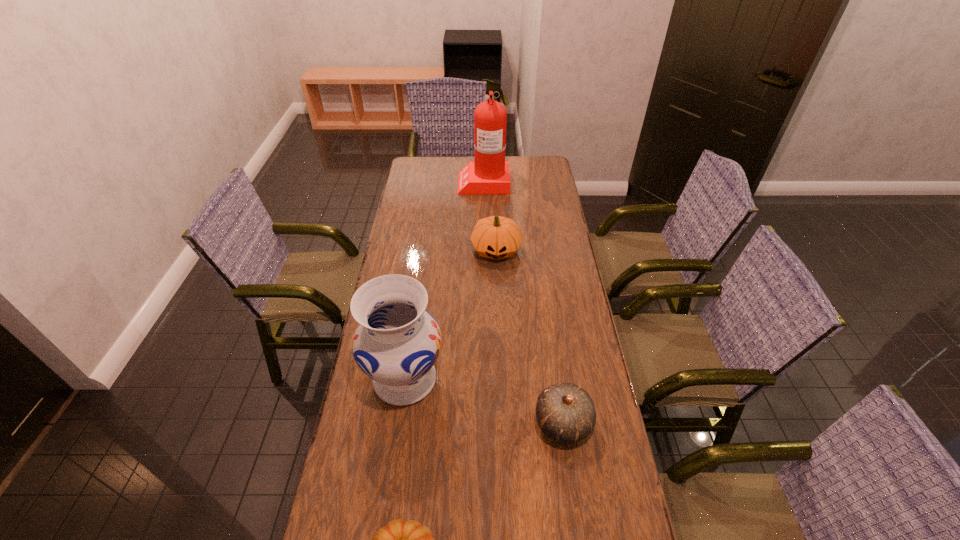
Find the location of a particular element. This screenshot has width=960, height=540. the farthest object is located at coordinates (489, 173).

Locate an element on the screen. fire extinguisher is located at coordinates (489, 173).

The height and width of the screenshot is (540, 960). Identify the location of vase. (397, 342).

Find the location of a particular element. The width and height of the screenshot is (960, 540). the farthest gourd is located at coordinates (496, 237).

At what (x,y) coordinates should I click in order to perform the action: click on the third tallest object. Please return your answer as a coordinate pair (x, y). Image resolution: width=960 pixels, height=540 pixels. Looking at the image, I should click on (496, 237).

Where is `the second nearest gourd`? Image resolution: width=960 pixels, height=540 pixels. the second nearest gourd is located at coordinates (566, 413).

Find the location of `the second tallest gourd`. the second tallest gourd is located at coordinates (566, 413).

Where is `free location located 0.150m on the front-facing side of the tallest object`? free location located 0.150m on the front-facing side of the tallest object is located at coordinates (427, 181).

The height and width of the screenshot is (540, 960). I want to click on vacant space situated on the front-facing side of the tallest object, so click(x=423, y=181).

I want to click on free space located 0.100m on the front-facing side of the tallest object, so click(x=438, y=181).